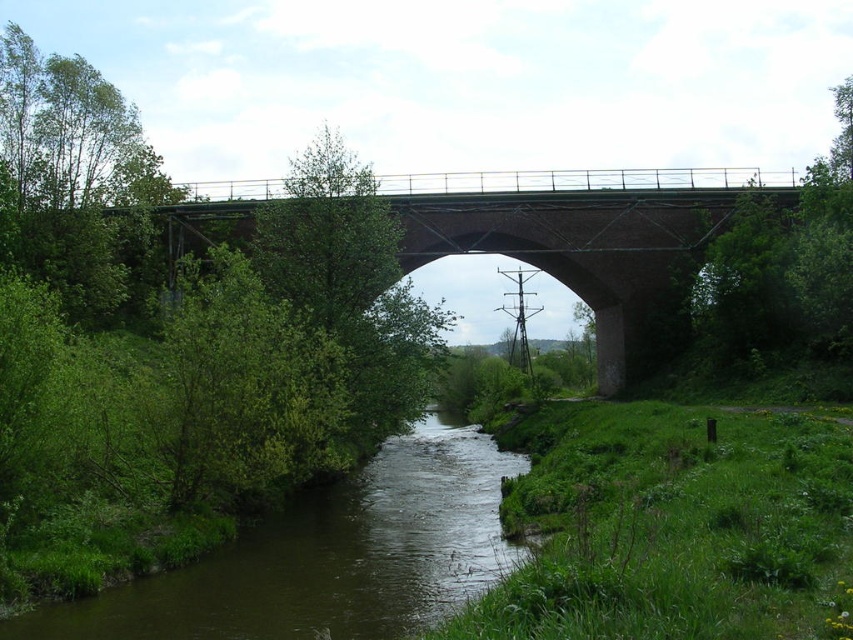
In the scene shown: Can you confirm if green muddy stream at center is bigger than brick/concrete bridge at center?

Incorrect, green muddy stream at center is not larger than brick/concrete bridge at center.

You are a GUI agent. You are given a task and a screenshot of the screen. Output one action in this format:
    pyautogui.click(x=<x>, y=<y>)
    Task: Click on the green muddy stream at center
    
    Given the screenshot: What is the action you would take?
    pyautogui.click(x=328, y=556)

This screenshot has width=853, height=640. What do you see at coordinates (328, 556) in the screenshot? I see `green muddy stream at center` at bounding box center [328, 556].

Locate an element on the screen. This screenshot has width=853, height=640. green muddy stream at center is located at coordinates (328, 556).